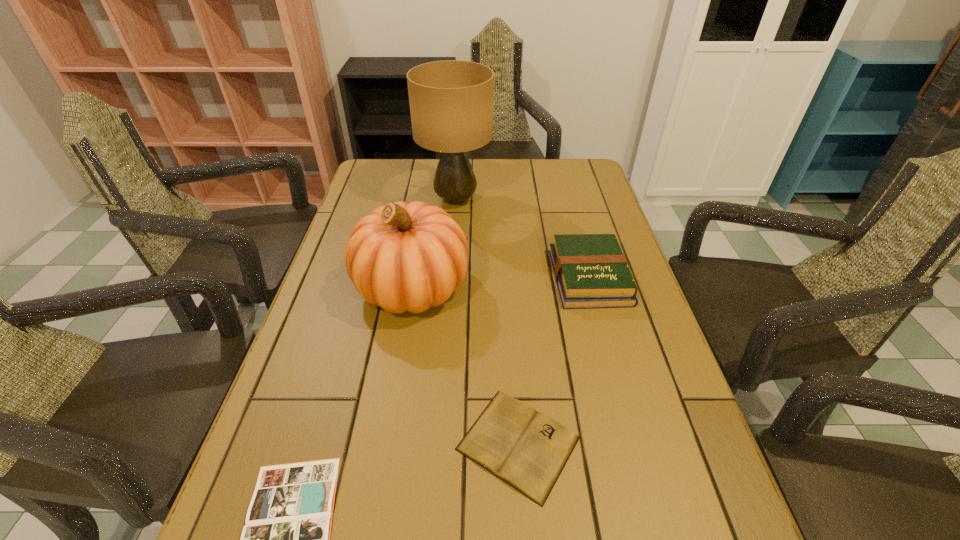
Identify the location of lampshade. (451, 102).

Where is `the tallest object`? The width and height of the screenshot is (960, 540). the tallest object is located at coordinates click(451, 102).

Locate an element on the screen. This screenshot has height=540, width=960. pumpkin is located at coordinates (401, 257).

Where is `the third shortest object`? This screenshot has width=960, height=540. the third shortest object is located at coordinates (591, 271).

The height and width of the screenshot is (540, 960). What are the coordinates of `the tallest book` in the screenshot? It's located at (591, 271).

Identify the location of the second shortest object. The image size is (960, 540). (528, 450).

At what (x,y) coordinates should I click in order to perform the action: click on the second tallest book. Please return your answer as a coordinate pair (x, y). This screenshot has width=960, height=540. Looking at the image, I should click on (528, 450).

At what (x,y) coordinates should I click in order to perform the action: click on free space located 0.370m on the front of the lampshade. Please return your answer as a coordinate pair (x, y). Looking at the image, I should click on (447, 309).

Find the location of a particular element. vacant space located on the back of the pumpkin is located at coordinates (422, 228).

Locate an element on the screen. The height and width of the screenshot is (540, 960). free location located 0.050m on the back of the rightmost book is located at coordinates (579, 239).